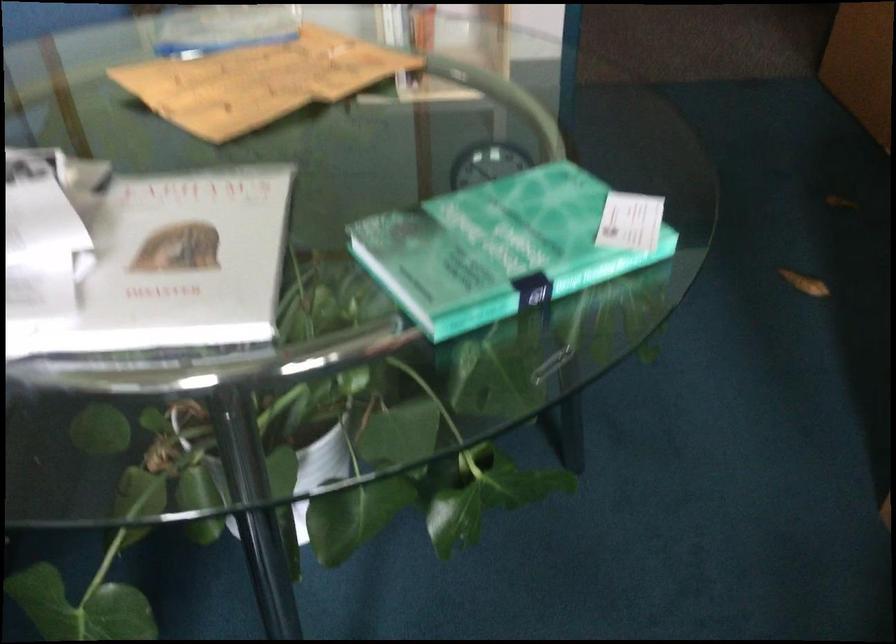
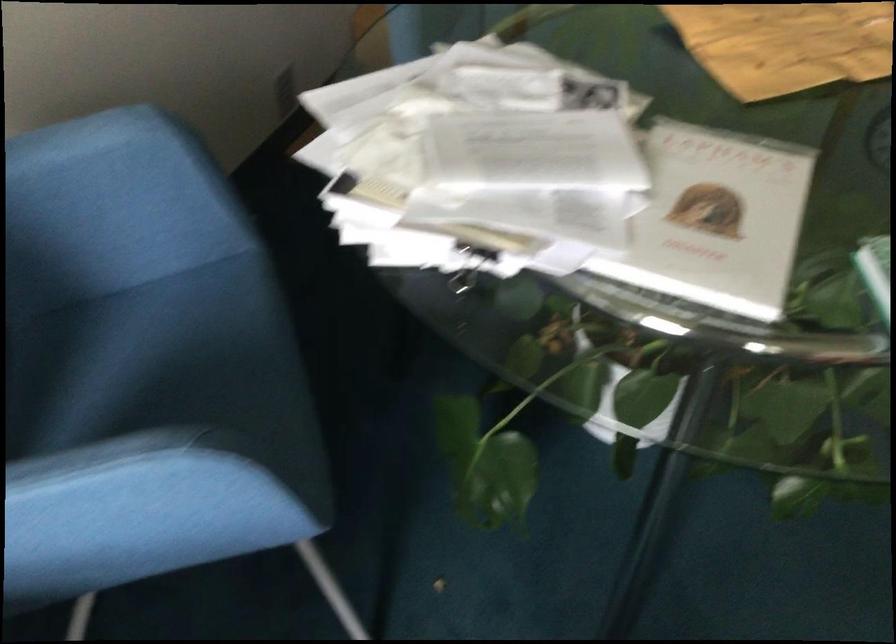
In the second image, find the point that corresponds to (251,86) in the first image.

(786, 44)